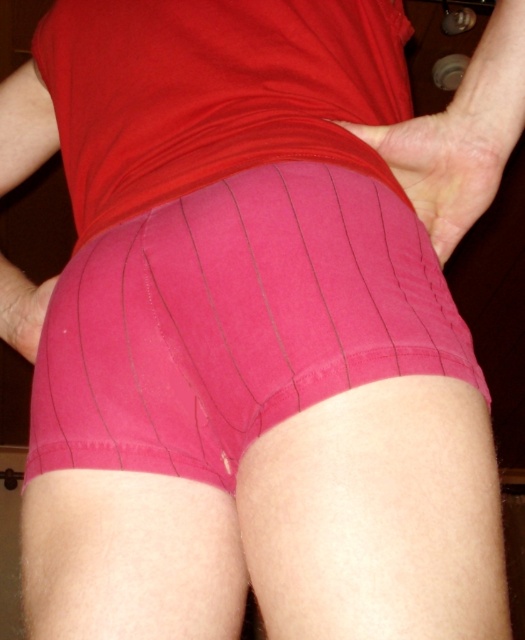
You are a fashion designer trying to create a new line of clothing. You observe the pink fabric shorts at center and dry skin at center in the image. Which one of these items has a larger surface area?

The pink fabric shorts at center has a larger surface area than the dry skin at center.

Based on the scene described, can you determine which object has a greater width between the dry skin at center and the pink fabric hand at lower left?

The dry skin at center has a greater width than the pink fabric hand at lower left.

You are a fashion designer observing the image. You need to determine which object, the dry skin at center or the pink fabric hand at lower left, is taller in the scene. Please state your answer clearly.

The dry skin at center is taller than the pink fabric hand at lower left according to the description.